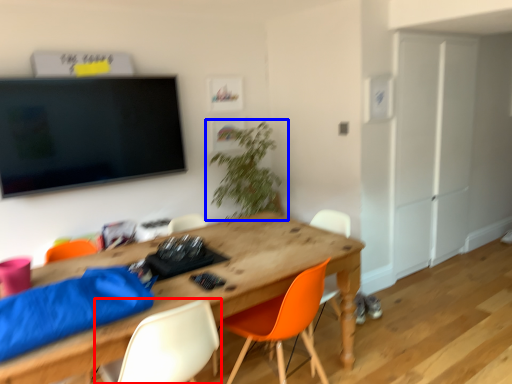
Question: Which point is further to the camera, chair (highlighted by a red box) or houseplant (highlighted by a blue box)?

Choices:
 (A) chair
 (B) houseplant

Answer: (B)